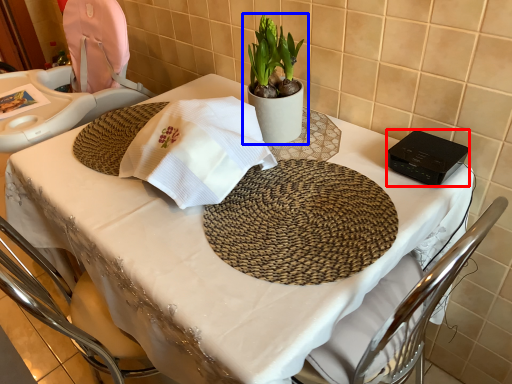
Question: Which point is further to the camera, gadget (highlighted by a red box) or houseplant (highlighted by a blue box)?

Choices:
 (A) gadget
 (B) houseplant

Answer: (B)